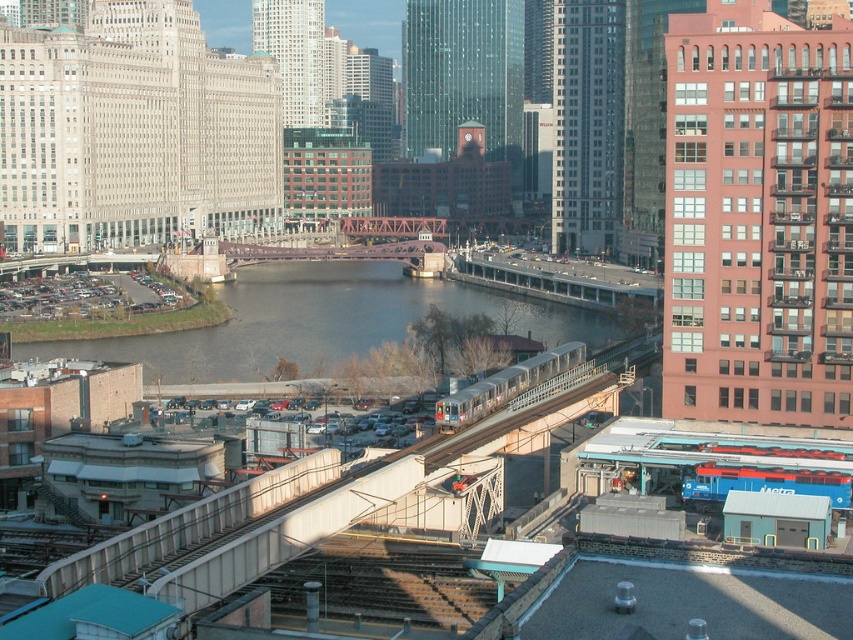
You are a city planner analyzing the urban layout. You notice the dark gray concrete waterway at center and the silver metallic train at center. Which of these two structures is located above the other in this scene?

The dark gray concrete waterway at center is positioned over the silver metallic train at center, so the waterway is above the train.

You are standing at a location in the city and want to know how far you are from the point marked at coordinates point (257,352). Based on the image, can you determine the distance?

The point marked at coordinates point (257,352) is 164.74 meters away from your current position.

You are a city planner reviewing this area. You need to determine the best location for a new bike path that connects the riverbank to the train station. Considering the dark gray concrete waterway at center and the silver metallic train at center, which object should the bike path be placed closer to in order to avoid blocking the train tracks?

The bike path should be placed closer to the dark gray concrete waterway at center since it is already to the left of the silver metallic train at center, allowing the path to stay clear of the train tracks.